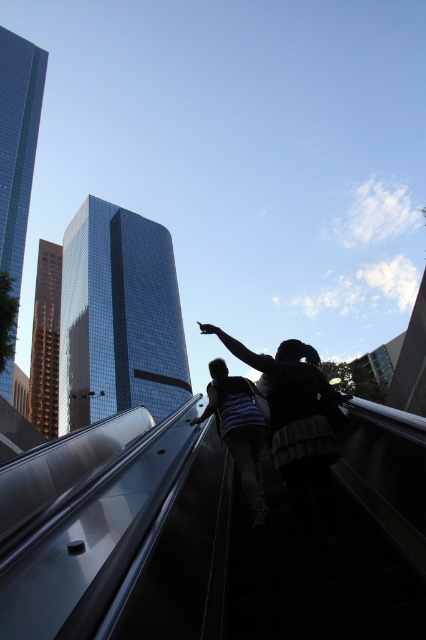
Based on the photo, you are standing at the base of the escalator in the city scene. There is a point marked at coordinates (302, 513). Can you reach this point without moving from your current position?

The point at coordinates (302, 513) is 2.90 meters away from the camera, so you can reach it without moving from your current position since it is within arm reach.

You are a delivery drone operator. Your drone needs to fly from the camera position to deliver a package to the silhouette casual clothing at center. The drone has a maximum flight range of 3 meters. Can the drone reach the target?

The distance between the silhouette casual clothing at center and the camera is 2.76 meters, which is within the drone operator maximum flight range of 3 meters. Therefore, the drone can reach the target.

You are a photographer standing at the bottom of the escalator. You want to take a photo of both the silhouette casual clothing at center and dark blue jeans at center. Which object should you focus on first to ensure both are in frame?

You should focus on the silhouette casual clothing at center first because it is wider than dark blue jeans at center, ensuring both fit within the frame.